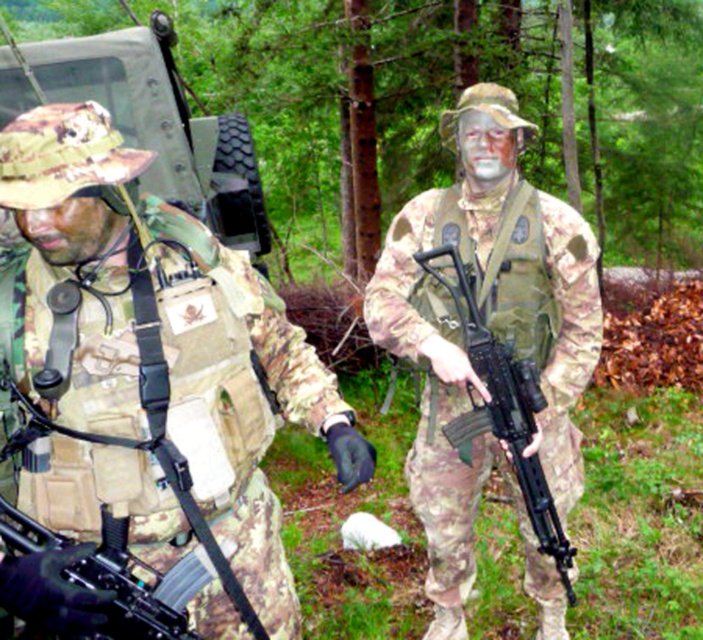
You are an observer analyzing the image of two soldiers in a forest. The scene shows two individuals wearing camouflage fabric uniforms at center. Which of the two, the camouflage fabric uniform at center or the camo fabric uniform at center, takes up less visual space in the image?

The camouflage fabric uniform at center occupies less space than the camo fabric uniform at center, so the camouflage fabric uniform at center takes up less visual space.

Based on the scene description, where is the camouflage fabric uniform at center located in terms of coordinates?

The camouflage fabric uniform at center is located at coordinates point (143,392).